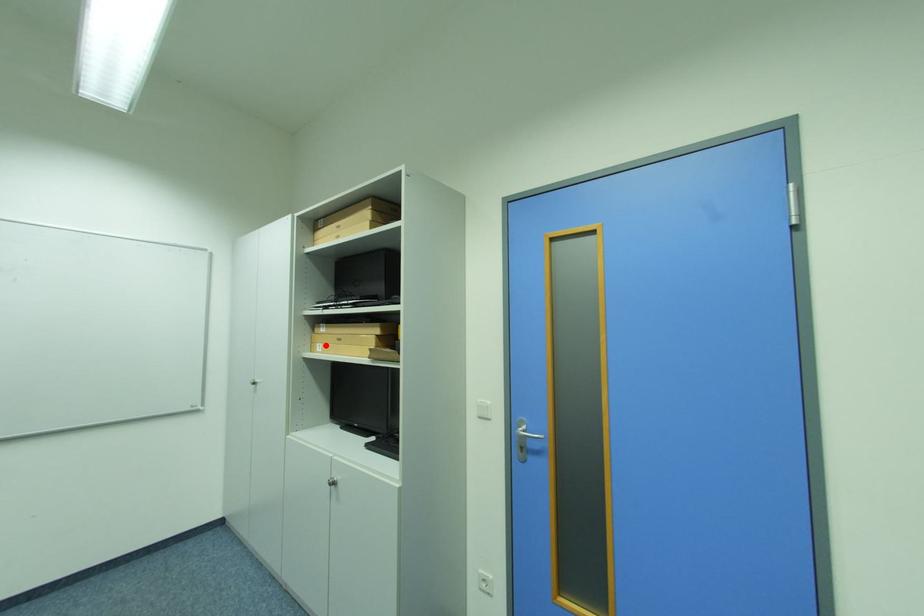
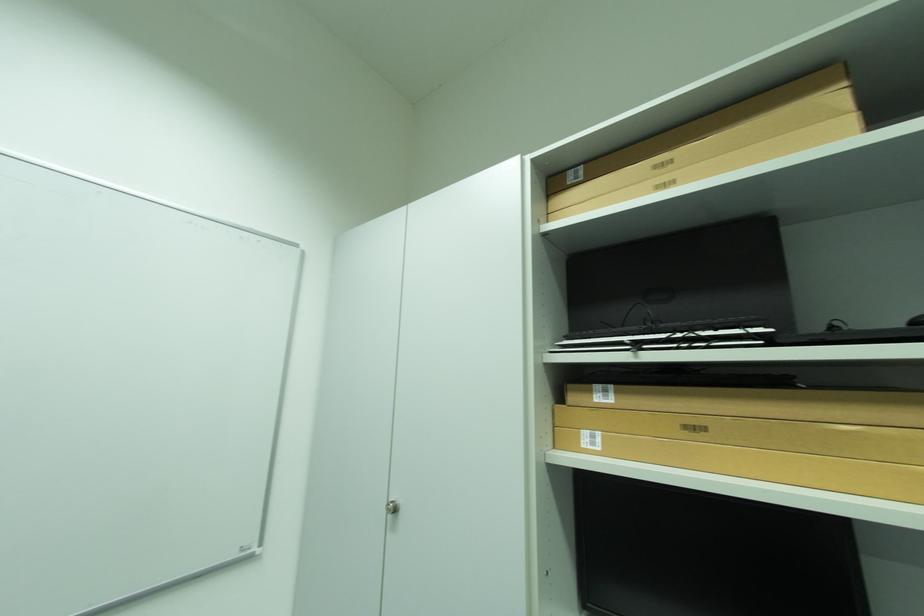
Question: I am providing you with two images of the same scene from different viewpoints. A red point is marked on the first image. At the location where the point appears in image 1, is it still visible in image 2?

Choices:
 (A) Yes
 (B) No

Answer: (A)